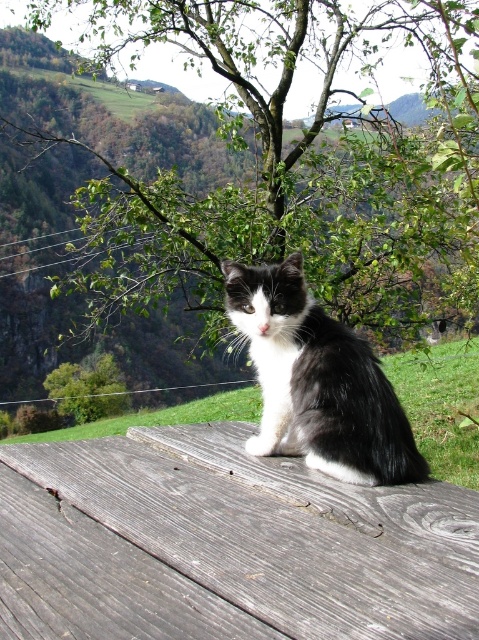
Question: Is green leafy tree at upper center bigger than black/white fur cat at center?

Choices:
 (A) no
 (B) yes

Answer: (B)

Question: Which of the following is the farthest from the observer?

Choices:
 (A) (214, 33)
 (B) (300, 468)

Answer: (A)

Question: Which point is closer to the camera?

Choices:
 (A) (315, 344)
 (B) (104, 29)

Answer: (A)

Question: Among these points, which one is farthest from the camera?

Choices:
 (A) (125, 196)
 (B) (305, 454)

Answer: (A)

Question: From the image, what is the correct spatial relationship of green leafy tree at upper center in relation to black/white fur cat at center?

Choices:
 (A) left
 (B) right

Answer: (B)

Question: Does green leafy tree at upper center have a lesser width compared to wooden plank at center?

Choices:
 (A) yes
 (B) no

Answer: (B)